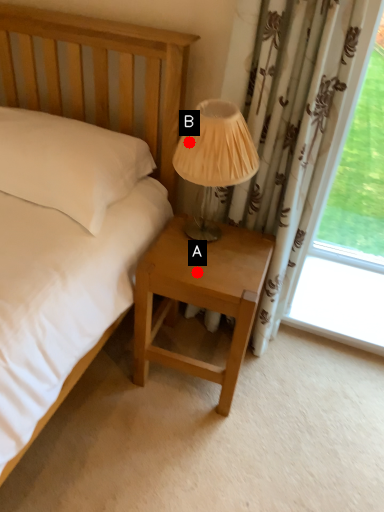
Question: Two points are circled on the image, labeled by A and B beside each circle. Which point is closer to the camera?

Choices:
 (A) A is closer
 (B) B is closer

Answer: (B)